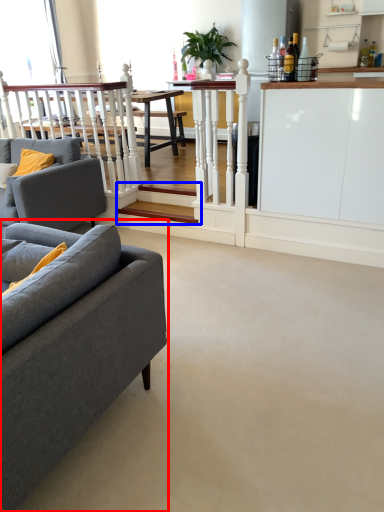
Question: Which of the following is the closest to the observer, studio couch (highlighted by a red box) or stairwell (highlighted by a blue box)?

Choices:
 (A) studio couch
 (B) stairwell

Answer: (A)